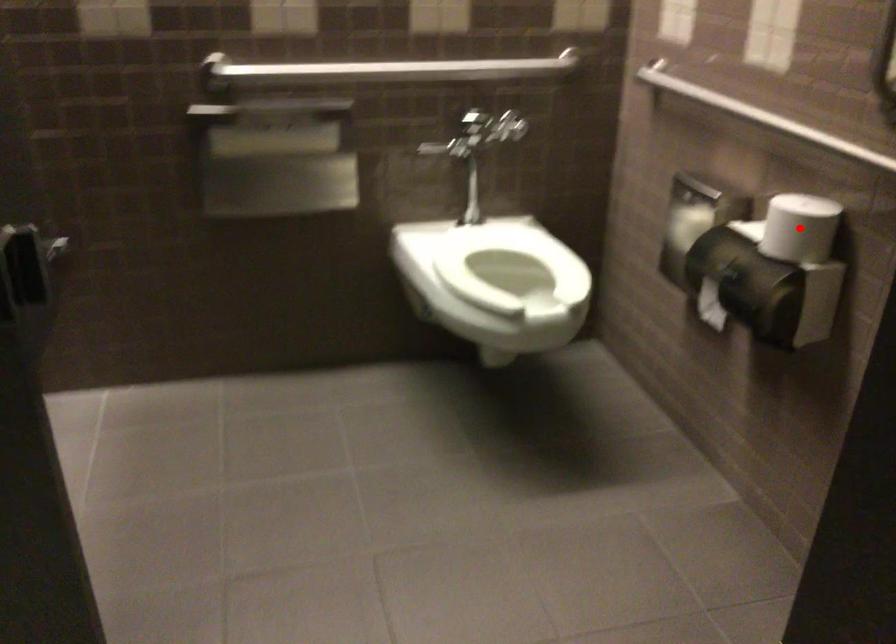
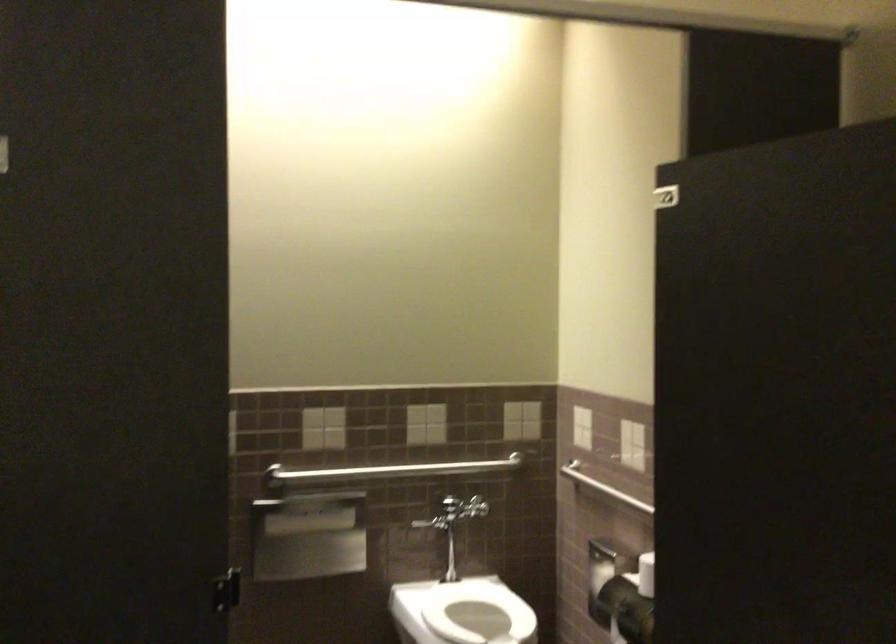
Question: I am providing you with two images of the same scene from different viewpoints. A red point is marked on the first image. Is the red point's position out of view in image 2?

Choices:
 (A) Yes
 (B) No

Answer: (A)